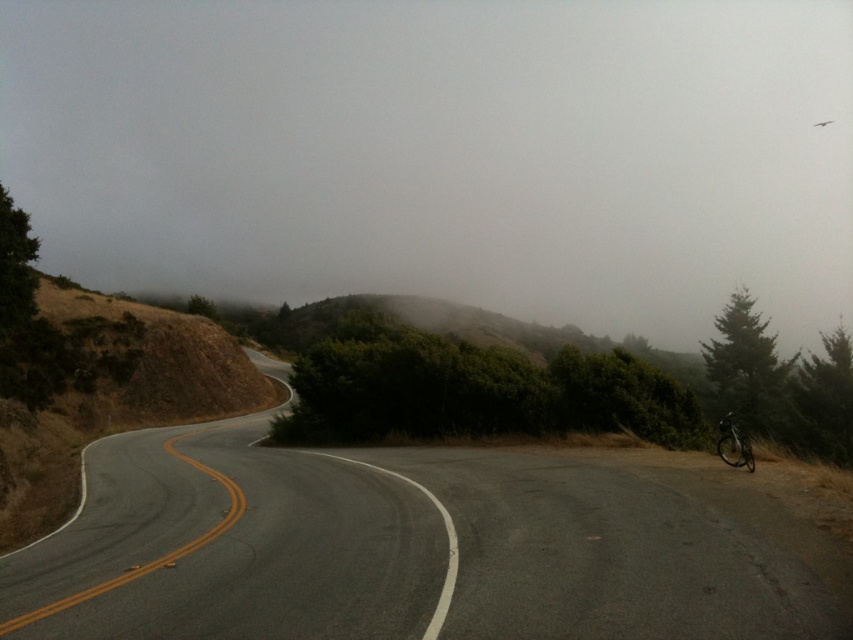
Between point (122, 602) and point (746, 444), which one is positioned in front?

Point (122, 602) is more forward.

Is asphalt road at center to the left of shiny black bicycle at right from the viewer's perspective?

Correct, you'll find asphalt road at center to the left of shiny black bicycle at right.

Does point (88, 540) come farther from viewer compared to point (730, 438)?

No, it is in front of (730, 438).

Find the location of a particular element. The height and width of the screenshot is (640, 853). asphalt road at center is located at coordinates (415, 547).